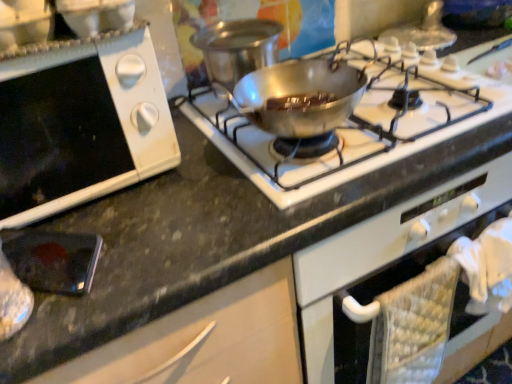
This screenshot has height=384, width=512. Identify the location of vacant area located to the right-hand side of white matte oven at lower left. (207, 185).